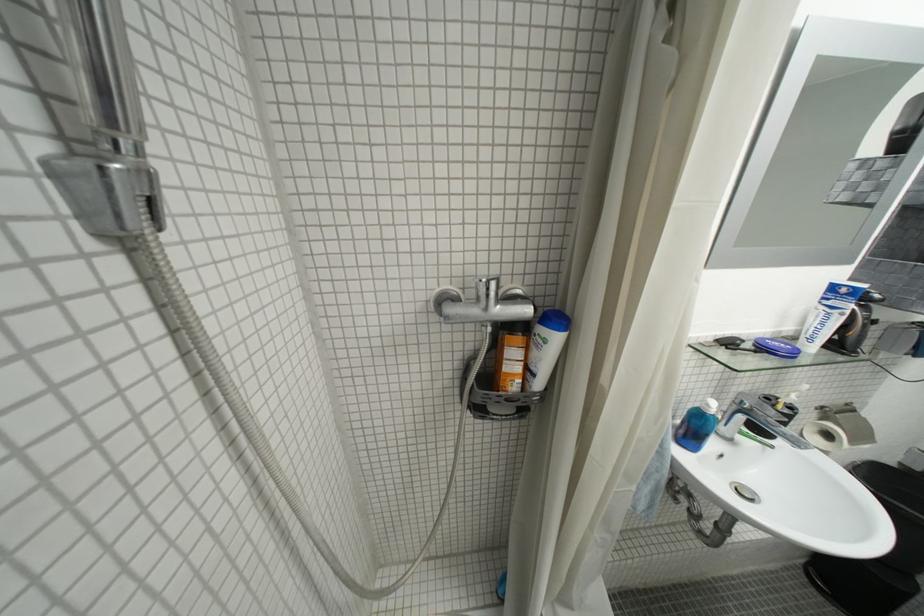
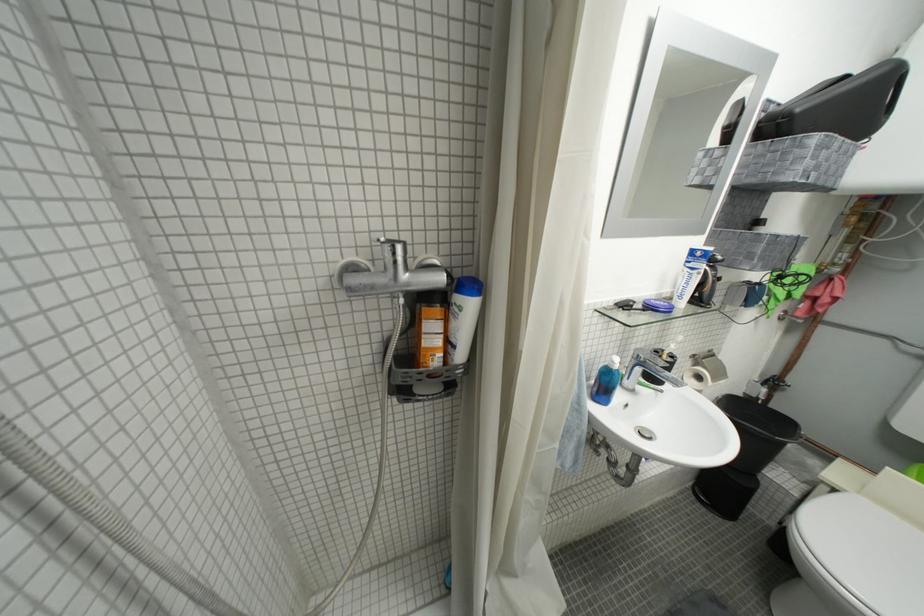
Which direction would the cameraman need to move to produce the second image?

The cameraman moved toward right, forward.